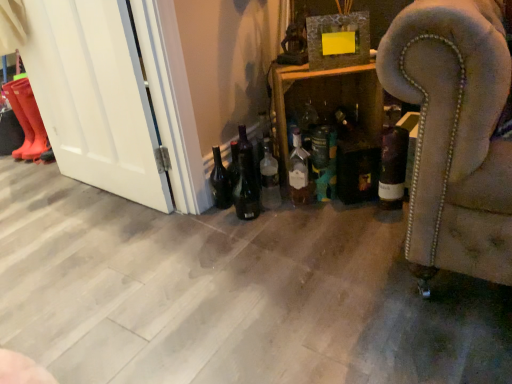
The image size is (512, 384). Identify the location of unoccupied region to the right of black glass beer bottle at lower center, acting as the first beer bottle starting from the right. (294, 216).